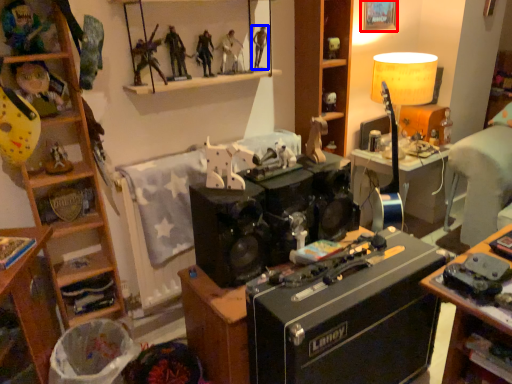
Question: Among these objects, which one is farthest to the camera, picture frame (highlighted by a red box) or person (highlighted by a blue box)?

Choices:
 (A) picture frame
 (B) person

Answer: (A)